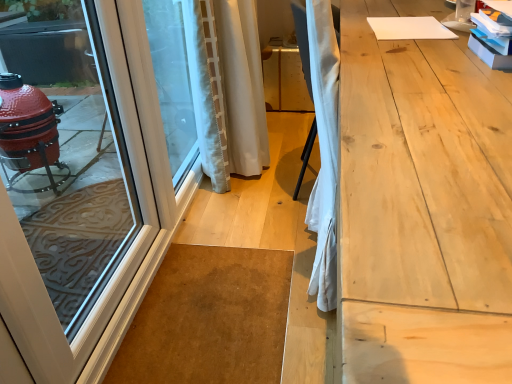
Question: In the image, is transparent glass window screen at left on the left side or the right side of light wood workbench at right?

Choices:
 (A) left
 (B) right

Answer: (A)

Question: Relative to light wood workbench at right, is transparent glass window screen at left in front or behind?

Choices:
 (A) front
 (B) behind

Answer: (B)

Question: Considering the real-world distances, which object is closest to the white glossy door at left?

Choices:
 (A) white textured curtain at center
 (B) transparent glass window screen at left
 (C) light wood workbench at right

Answer: (B)

Question: Based on their relative distances, which object is farther from the white glossy door at left?

Choices:
 (A) transparent glass window screen at left
 (B) light wood workbench at right
 (C) white textured curtain at center

Answer: (B)